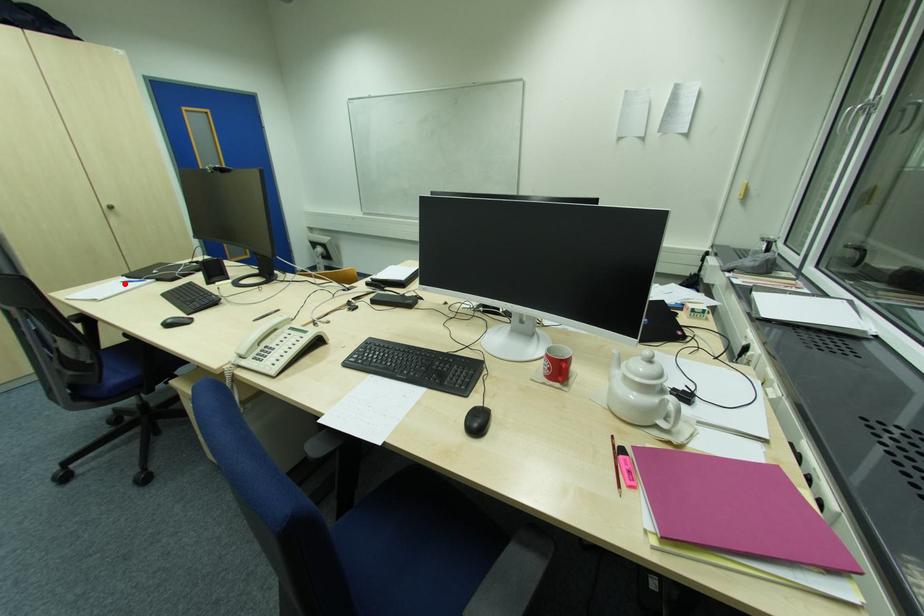
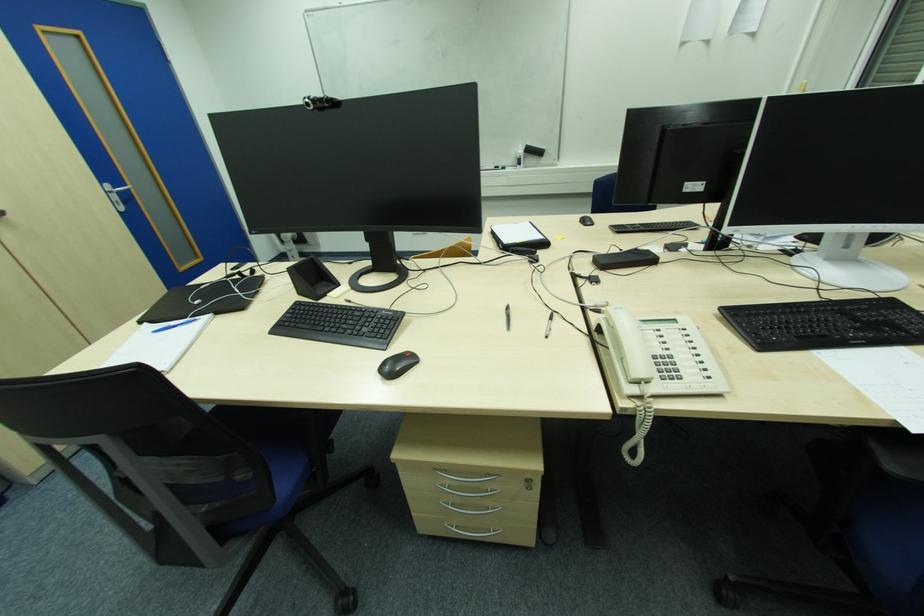
Where in the second image is the point corresponding to the highlighted location from the first image?

(156, 333)